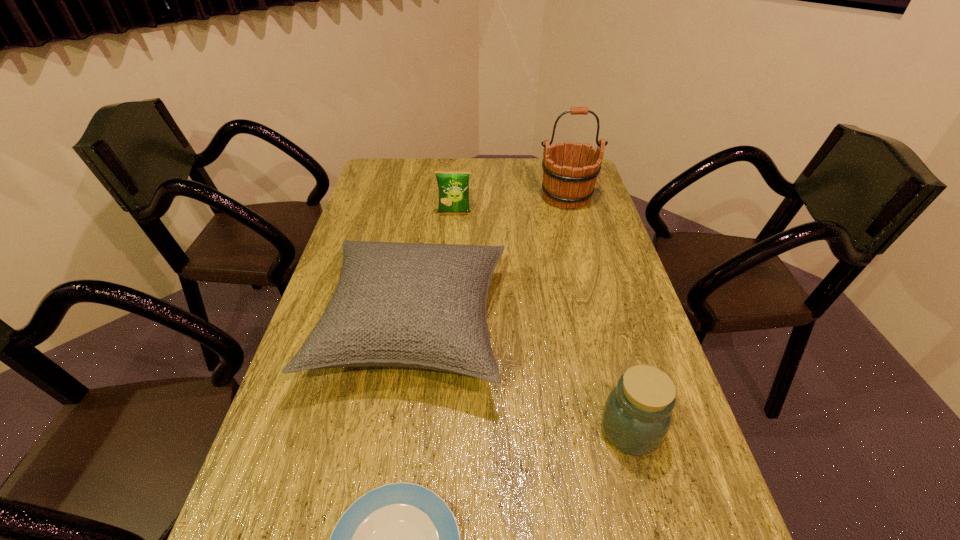
The width and height of the screenshot is (960, 540). In order to click on vacant point located between the wine bucket and the jar in this screenshot , I will do `click(598, 314)`.

Select which object is the fourth closest to the nearest object. Please provide its 2D coordinates. Your answer should be formatted as a tuple, i.e. [(x, y)], where the tuple contains the x and y coordinates of a point satisfying the conditions above.

[(562, 185)]

Identify which object is located as the second nearest to the tallest object. Please provide its 2D coordinates. Your answer should be formatted as a tuple, i.e. [(x, y)], where the tuple contains the x and y coordinates of a point satisfying the conditions above.

[(415, 305)]

Find the location of `blank space that satisfies the following two spatial constraints: 1. on the back side of the tallest object; 2. on the right side of the second tallest object`. blank space that satisfies the following two spatial constraints: 1. on the back side of the tallest object; 2. on the right side of the second tallest object is located at coordinates (433, 197).

This screenshot has height=540, width=960. I want to click on vacant region that satisfies the following two spatial constraints: 1. on the front-facing side of the crisp (potato chip); 2. on the left side of the jar, so click(x=438, y=430).